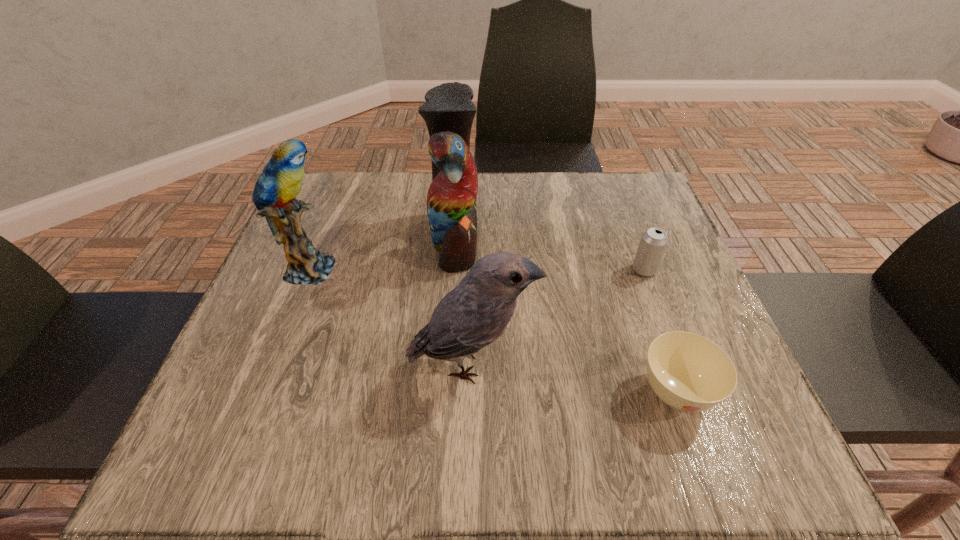
The height and width of the screenshot is (540, 960). I want to click on free space at the far right corner of the desktop, so click(615, 217).

What are the coordinates of `empty space between the shortest object and the beer can` in the screenshot? It's located at click(660, 331).

Locate an element on the screen. The image size is (960, 540). vacant region between the sugar bowl and the third tallest object is located at coordinates (573, 378).

Find the location of a particular element. This screenshot has width=960, height=540. vacant area that lies between the shortest parrot and the leftmost object is located at coordinates (390, 316).

At what (x,y) coordinates should I click in order to perform the action: click on vacant space that's between the leftmost object and the nearest parrot. Please return your answer as a coordinate pair (x, y). The width and height of the screenshot is (960, 540). Looking at the image, I should click on (390, 316).

Image resolution: width=960 pixels, height=540 pixels. Find the location of `free area in between the beer can and the shortest parrot`. free area in between the beer can and the shortest parrot is located at coordinates (558, 316).

Identify which object is located as the nearest to the leftmost object. Please provide its 2D coordinates. Your answer should be formatted as a tuple, i.e. [(x, y)], where the tuple contains the x and y coordinates of a point satisfying the conditions above.

[(449, 111)]

Where is `object that is the second closest to the leftmost parrot`? The image size is (960, 540). object that is the second closest to the leftmost parrot is located at coordinates (476, 312).

Point out which parrot is positioned as the second nearest to the third tallest object. Please provide its 2D coordinates. Your answer should be formatted as a tuple, i.e. [(x, y)], where the tuple contains the x and y coordinates of a point satisfying the conditions above.

[(281, 181)]

Locate which parrot is the closest to the fourth tallest object. Please provide its 2D coordinates. Your answer should be formatted as a tuple, i.e. [(x, y)], where the tuple contains the x and y coordinates of a point satisfying the conditions above.

[(476, 312)]